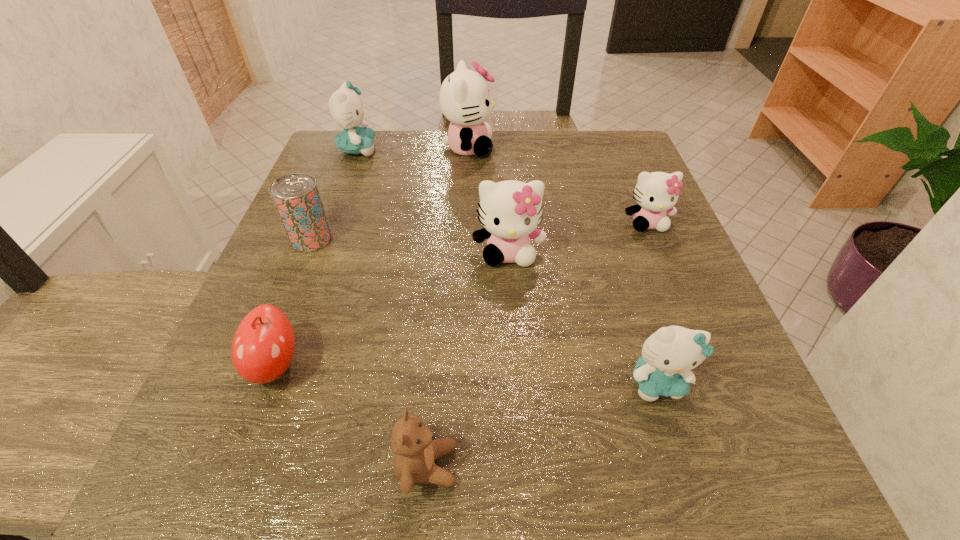
Image resolution: width=960 pixels, height=540 pixels. Identify the location of object that is at the near edge. (412, 442).

Where is `kitten at the left edge`? kitten at the left edge is located at coordinates (345, 106).

Where is `beer can positioned at the left edge`? Image resolution: width=960 pixels, height=540 pixels. beer can positioned at the left edge is located at coordinates (296, 196).

This screenshot has width=960, height=540. Find the location of `apple positioned at the left edge`. apple positioned at the left edge is located at coordinates (263, 346).

The width and height of the screenshot is (960, 540). I want to click on object present at the far left corner, so click(x=345, y=106).

Where is `free region at the far edge`? free region at the far edge is located at coordinates (431, 134).

You are a GUI agent. You are given a task and a screenshot of the screen. Output one action in this format:
    pyautogui.click(x=<x>, y=<y>)
    Task: Click on the vacant space at the left edge
    This screenshot has width=960, height=540.
    Given the screenshot: What is the action you would take?
    click(287, 238)

Identify the location of vacant space at the right edge. (584, 188).

Where is `free location at the far left corner of the desktop`? The image size is (960, 540). free location at the far left corner of the desktop is located at coordinates (343, 160).

Image resolution: width=960 pixels, height=540 pixels. I want to click on free space at the near left corner of the desktop, so click(x=292, y=465).